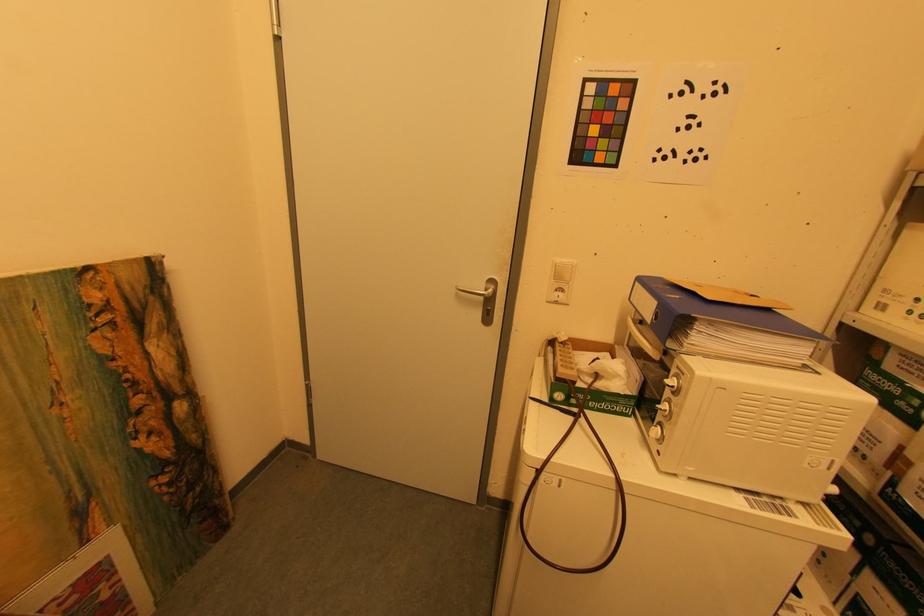
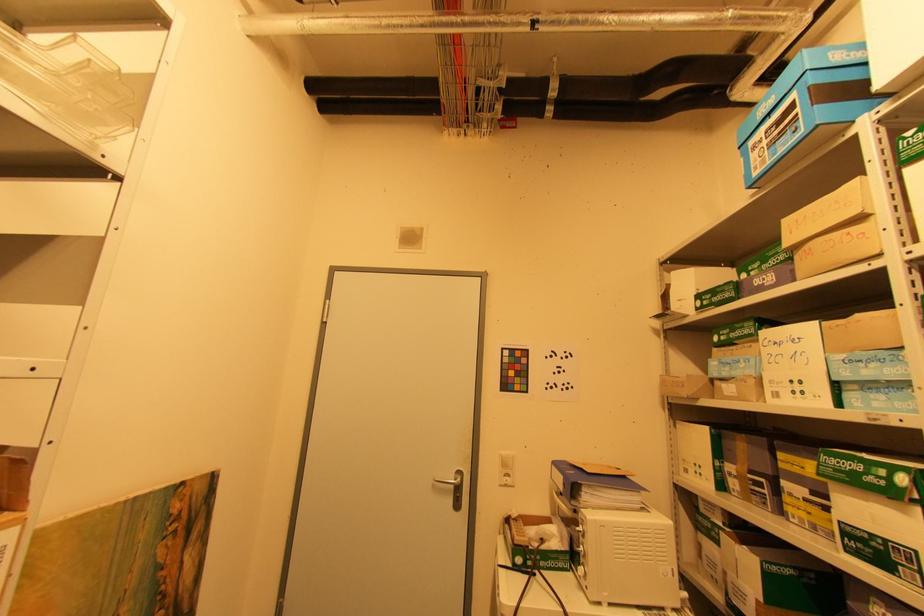
Question: The images are taken continuously from a first-person perspective. In which direction is your viewpoint rotating?

Choices:
 (A) Left
 (B) Right
 (C) Up
 (D) Down

Answer: (C)